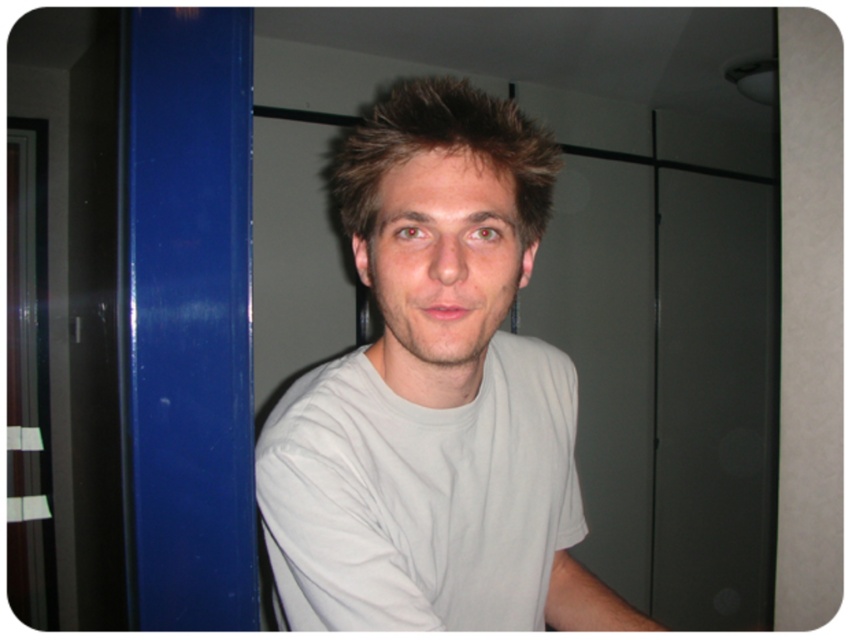
The height and width of the screenshot is (640, 852). I want to click on white cotton t-shirt at center, so click(419, 496).

Does white cotton t-shirt at center have a lesser width compared to spiky brown hair at center?

In fact, white cotton t-shirt at center might be wider than spiky brown hair at center.

Who is more distant from viewer, (528, 625) or (372, 208)?

Point (528, 625)

The width and height of the screenshot is (852, 640). Identify the location of white cotton t-shirt at center. (419, 496).

Who is positioned more to the left, white cotton shirt at center or spiky brown hair at center?

white cotton shirt at center

Consider the image. Is white cotton shirt at center taller than spiky brown hair at center?

Correct, white cotton shirt at center is much taller as spiky brown hair at center.

Which is in front, point (521, 435) or point (471, 122)?

Point (471, 122) is in front.

The width and height of the screenshot is (852, 640). In order to click on white cotton shirt at center in this screenshot , I will do `click(435, 396)`.

Can you confirm if white cotton shirt at center is positioned to the right of white cotton t-shirt at center?

No, white cotton shirt at center is not to the right of white cotton t-shirt at center.

Can you confirm if white cotton shirt at center is positioned above white cotton t-shirt at center?

Indeed, white cotton shirt at center is positioned over white cotton t-shirt at center.

Does point (492, 241) come behind point (327, 390)?

No, (492, 241) is closer to viewer.

Locate an element on the screen. white cotton shirt at center is located at coordinates (435, 396).